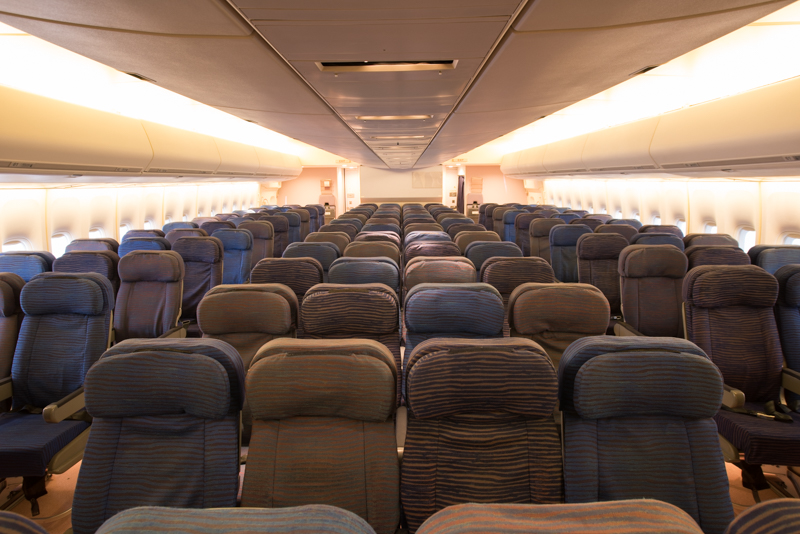
Identify the location of storage place. (754, 131), (629, 136), (569, 153), (536, 154), (510, 156), (26, 129), (188, 145), (240, 155), (274, 155), (298, 161).